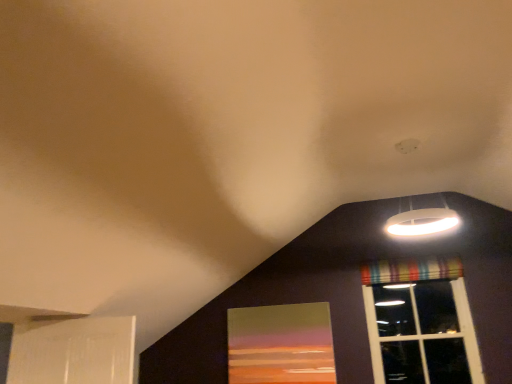
Question: From a real-world perspective, relative to striped fabric curtain at upper right, is matte glass window screen at lower center vertically above or below?

Choices:
 (A) below
 (B) above

Answer: (A)

Question: Considering their positions, is matte glass window screen at lower center located in front of or behind striped fabric curtain at upper right?

Choices:
 (A) front
 (B) behind

Answer: (A)

Question: Considering the real-world distances, which object is farthest from the striped fabric curtain at upper right?

Choices:
 (A) striped fabric window at upper right
 (B) white matte lampshade at upper right
 (C) matte glass window screen at lower center

Answer: (C)

Question: Which object is positioned closest to the striped fabric curtain at upper right?

Choices:
 (A) striped fabric window at upper right
 (B) matte glass window screen at lower center
 (C) white matte lampshade at upper right

Answer: (A)